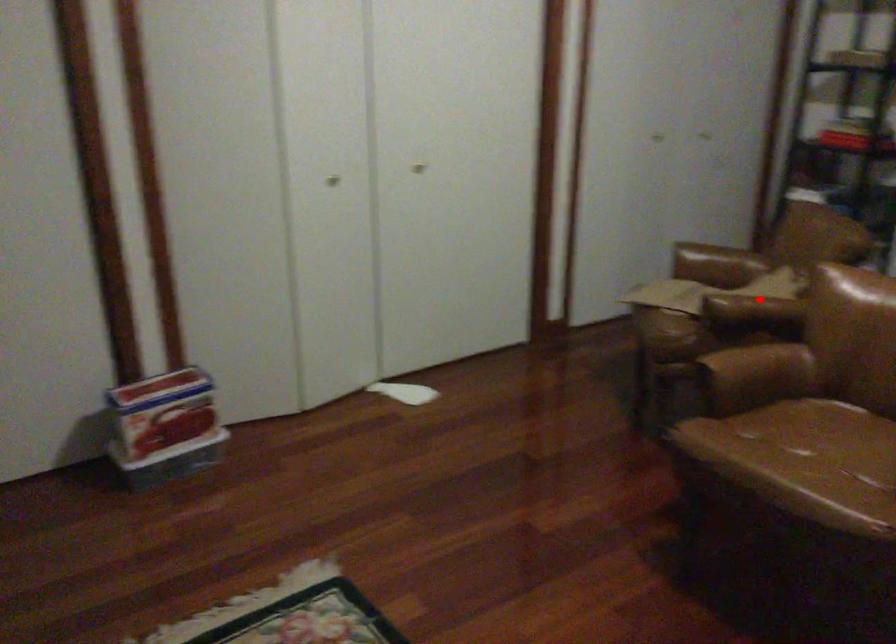
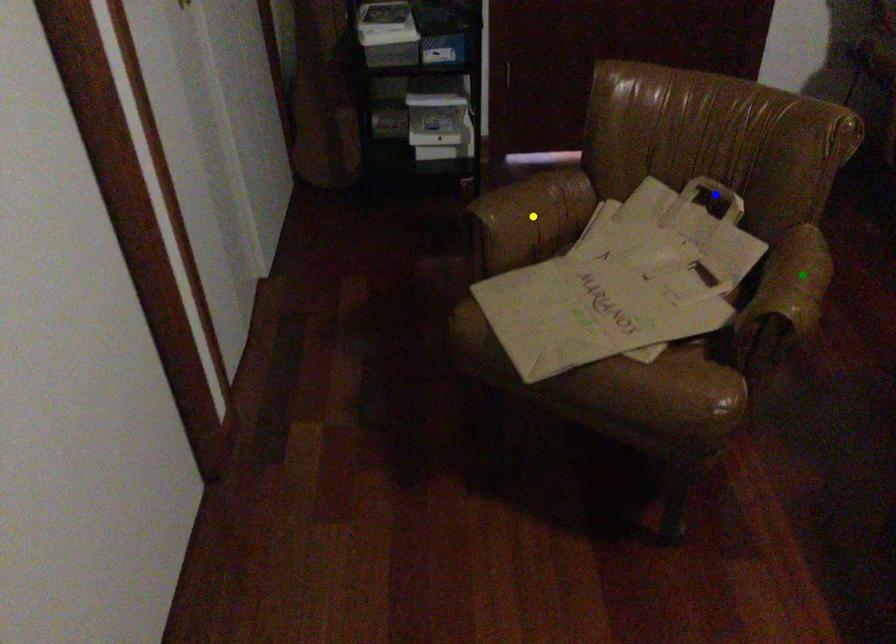
Question: I am providing you with two images of the same scene from different viewpoints. A red point is marked on the first image. You are given multiple points on the second image. Which point in image 2 is actually the same real-world point as the red point in image 1?

Choices:
 (A) blue point
 (B) green point
 (C) yellow point

Answer: (B)